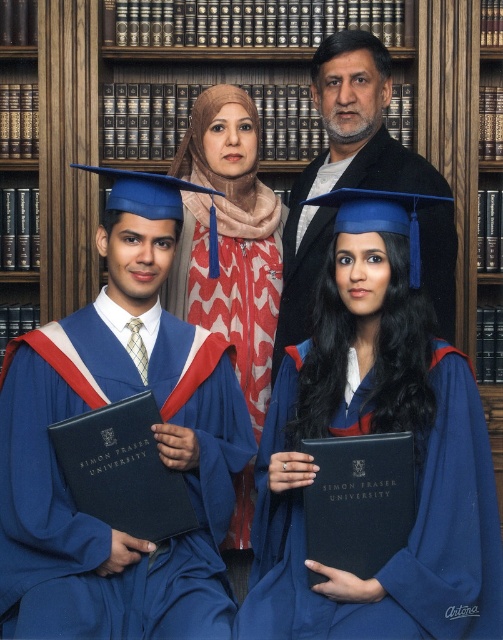
You are a photographer at Simon Fraser University. You need to take a group photo of the graduates wearing their gowns. The blue matte graduation gown at center and the matte blue gown at center are both in the frame. Which gown is narrower in width?

The blue matte graduation gown at center is narrower in width than the matte blue gown at center according to the description.

You are standing in the Simon Fraser University graduation ceremony. You want to take a photo of the blue matte graduation gown at center from a distance that is exactly 10 feet away. Is it possible to adjust your position to achieve this?

The blue matte graduation gown at center is currently 9.67 feet away from the viewer. Since 9.67 feet is less than 10 feet, you can move slightly backward to increase the distance to exactly 10 feet and take the photo.